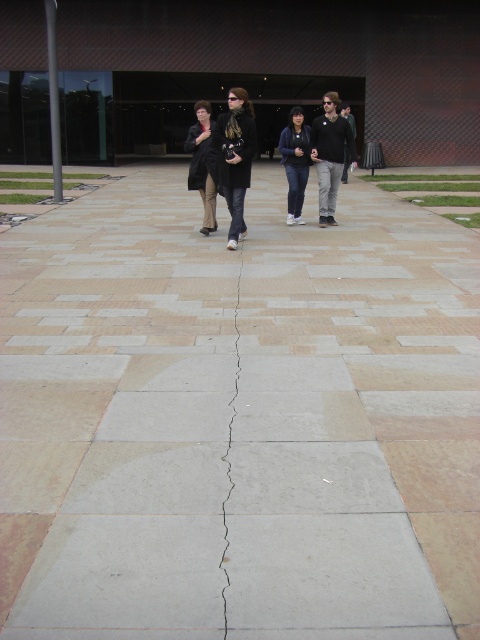
Question: Which object is farther from the camera taking this photo?

Choices:
 (A) cracked concrete at center
 (B) dark brown leather jacket at center

Answer: (B)

Question: Can you confirm if dark gray sweater at center is thinner than cracked concrete at center?

Choices:
 (A) no
 (B) yes

Answer: (A)

Question: Is smooth stone pavement at center positioned at the back of dark blue jeans at center?

Choices:
 (A) no
 (B) yes

Answer: (A)

Question: Which object is farther from the camera taking this photo?

Choices:
 (A) dark gray sweater at center
 (B) smooth stone pavement at center

Answer: (A)

Question: Can you confirm if dark gray sweater at center is smaller than dark blue jeans at center?

Choices:
 (A) yes
 (B) no

Answer: (B)

Question: Based on their relative distances, which object is farther from the cracked concrete at center?

Choices:
 (A) dark gray sweater at center
 (B) dark brown leather jacket at center

Answer: (A)